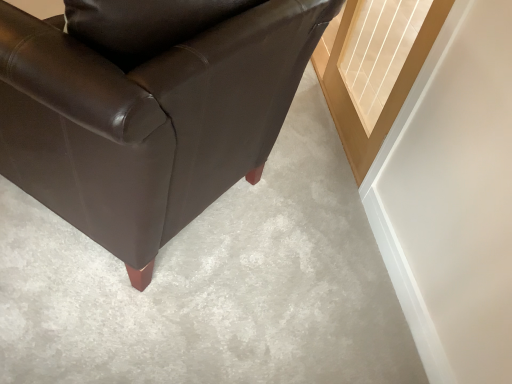
This screenshot has height=384, width=512. What do you see at coordinates (374, 68) in the screenshot?
I see `clear glass door at upper right` at bounding box center [374, 68].

This screenshot has height=384, width=512. What are the coordinates of `clear glass door at upper right` in the screenshot? It's located at (374, 68).

What is the approximate width of clear glass door at upper right?

clear glass door at upper right is 6.11 inches in width.

What do you see at coordinates (147, 121) in the screenshot? This screenshot has width=512, height=384. I see `matte black leather chair at lower left` at bounding box center [147, 121].

In order to click on matte black leather chair at lower left in this screenshot , I will do `click(147, 121)`.

At what (x,y) coordinates should I click in order to perform the action: click on clear glass door at upper right. Please return your answer as a coordinate pair (x, y). The width and height of the screenshot is (512, 384). Looking at the image, I should click on (374, 68).

Is matte black leather chair at lower left to the left of clear glass door at upper right from the viewer's perspective?

Yes.

Between matte black leather chair at lower left and clear glass door at upper right, which one is positioned behind?

Positioned behind is clear glass door at upper right.

Is point (129, 95) closer or farther from the camera than point (349, 133)?

Clearly, point (129, 95) is closer to the camera than point (349, 133).

Looking at this image, from the image's perspective, is matte black leather chair at lower left above or below clear glass door at upper right?

From the image's perspective, matte black leather chair at lower left appears below clear glass door at upper right.

From a real-world perspective, is matte black leather chair at lower left physically above clear glass door at upper right?

Yes, from a real-world perspective, matte black leather chair at lower left is above clear glass door at upper right.

Is matte black leather chair at lower left thinner than clear glass door at upper right?

Incorrect, the width of matte black leather chair at lower left is not less than that of clear glass door at upper right.

Which of these two, matte black leather chair at lower left or clear glass door at upper right, stands taller?

matte black leather chair at lower left is taller.

Considering the sizes of objects matte black leather chair at lower left and clear glass door at upper right in the image provided, who is bigger, matte black leather chair at lower left or clear glass door at upper right?

matte black leather chair at lower left is bigger.

Do you think matte black leather chair at lower left is within clear glass door at upper right, or outside of it?

matte black leather chair at lower left is not enclosed by clear glass door at upper right.

Is matte black leather chair at lower left touching clear glass door at upper right?

There is a gap between matte black leather chair at lower left and clear glass door at upper right.

Is clear glass door at upper right at the back of matte black leather chair at lower left?

No, clear glass door at upper right is not at the back of matte black leather chair at lower left.

This screenshot has width=512, height=384. What are the coordinates of `window on the right of the matte black leather chair at lower left` in the screenshot? It's located at (374, 68).

Can you confirm if clear glass door at upper right is positioned to the right of matte black leather chair at lower left?

Correct, you'll find clear glass door at upper right to the right of matte black leather chair at lower left.

Consider the image. Considering the positions of objects clear glass door at upper right and matte black leather chair at lower left in the image provided, who is behind, clear glass door at upper right or matte black leather chair at lower left?

clear glass door at upper right is further from the camera.

From the picture: Which is less distant, (x=352, y=77) or (x=244, y=165)?

The point (x=244, y=165) is closer.

Looking at this image, from the image's perspective, is clear glass door at upper right below matte black leather chair at lower left?

Incorrect, from the image's perspective, clear glass door at upper right is higher than matte black leather chair at lower left.

From a real-world perspective, which is physically above, clear glass door at upper right or matte black leather chair at lower left?

matte black leather chair at lower left is physically above.

Considering the sizes of objects clear glass door at upper right and matte black leather chair at lower left in the image provided, who is wider, clear glass door at upper right or matte black leather chair at lower left?

Wider between the two is matte black leather chair at lower left.

Between clear glass door at upper right and matte black leather chair at lower left, which one has more height?

Standing taller between the two is matte black leather chair at lower left.

Can you confirm if clear glass door at upper right is smaller than matte black leather chair at lower left?

Indeed, clear glass door at upper right has a smaller size compared to matte black leather chair at lower left.

Is clear glass door at upper right located outside matte black leather chair at lower left?

Indeed, clear glass door at upper right is completely outside matte black leather chair at lower left.

Is clear glass door at upper right touching matte black leather chair at lower left?

No, clear glass door at upper right is not beside matte black leather chair at lower left.

Is clear glass door at upper right looking in the opposite direction of matte black leather chair at lower left?

clear glass door at upper right does not have its back to matte black leather chair at lower left.

How many degrees apart are the facing directions of clear glass door at upper right and matte black leather chair at lower left?

43.3 degrees.

Identify the location of window behind the matte black leather chair at lower left. (374, 68).

You are a GUI agent. You are given a task and a screenshot of the screen. Output one action in this format:
    pyautogui.click(x=<x>, y=<y>)
    Task: Click on the window below the matte black leather chair at lower left (from a real-world perspective)
    
    Given the screenshot: What is the action you would take?
    pyautogui.click(x=374, y=68)

At what (x,y) coordinates should I click in order to perform the action: click on window that is on the right side of matte black leather chair at lower left. Please return your answer as a coordinate pair (x, y). The height and width of the screenshot is (384, 512). Looking at the image, I should click on (374, 68).